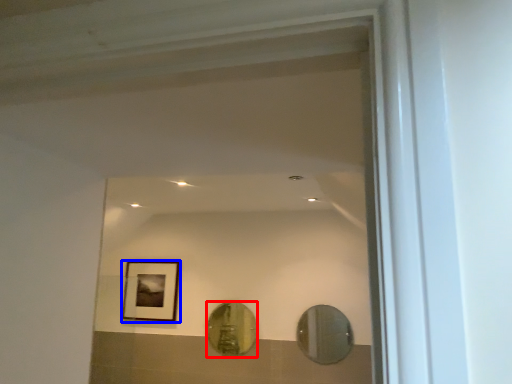
Question: Which object is closer to the camera taking this photo, mirror (highlighted by a red box) or picture frame (highlighted by a blue box)?

Choices:
 (A) mirror
 (B) picture frame

Answer: (A)